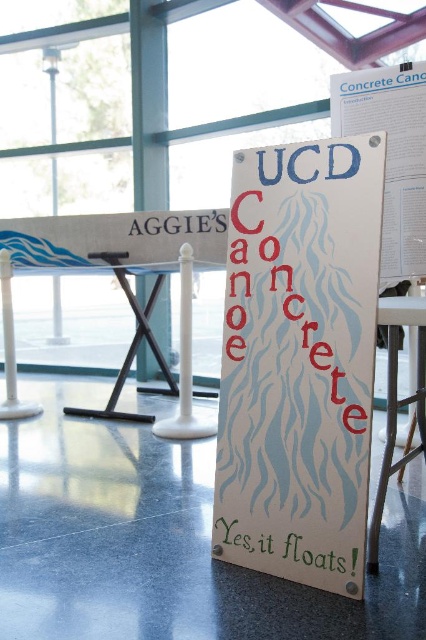
What do you see at coordinates (391, 154) in the screenshot? I see `white paper at upper center` at bounding box center [391, 154].

Does white paper at upper center lie behind green painted wood yes, it floats! at lower center?

Yes, white paper at upper center is behind green painted wood yes, it floats! at lower center.

Identify the location of white paper at upper center. (391, 154).

Where is `white paper at upper center`? The width and height of the screenshot is (426, 640). white paper at upper center is located at coordinates (391, 154).

Is white paper at upper center positioned at the back of black paper at center?

That is False.

Between point (391, 205) and point (226, 216), which one is positioned in front?

Point (391, 205)

Locate an element on the screen. Image resolution: width=426 pixels, height=640 pixels. white paper at upper center is located at coordinates click(x=391, y=154).

Which is more to the left, matte white signboard at center or blue paper sign at center?

blue paper sign at center

Looking at this image, which is above, matte white signboard at center or blue paper sign at center?

blue paper sign at center is higher up.

At what (x,y) coordinates should I click in order to perform the action: click on matte white signboard at center. Please return your answer as a coordinate pair (x, y). The image size is (426, 640). Looking at the image, I should click on (299, 360).